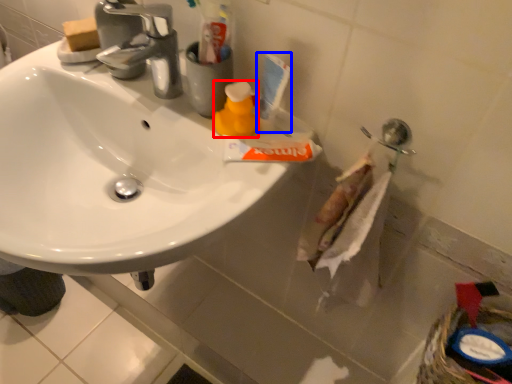
Question: Which point is closer to the camera, cleaning product (highlighted by a red box) or toiletry (highlighted by a blue box)?

Choices:
 (A) cleaning product
 (B) toiletry

Answer: (B)